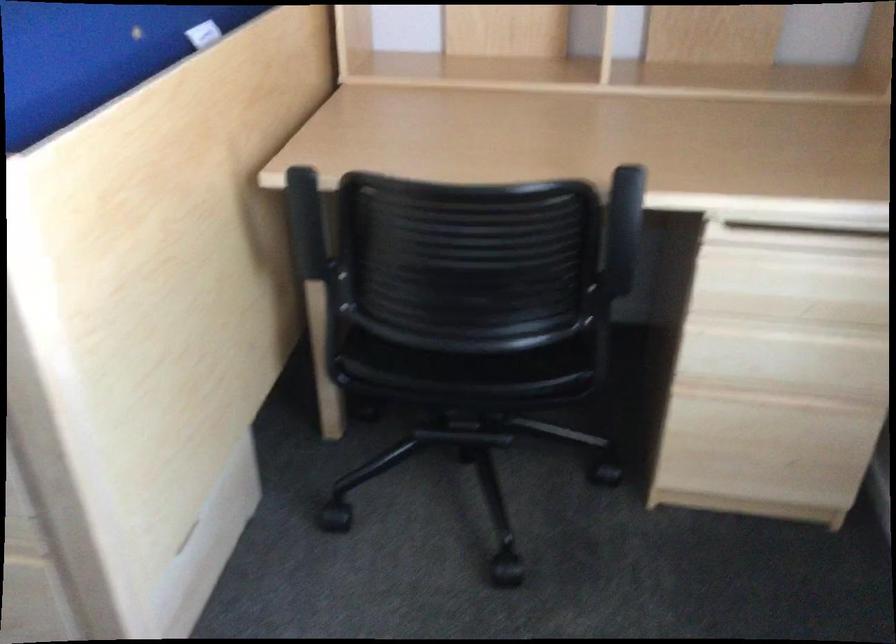
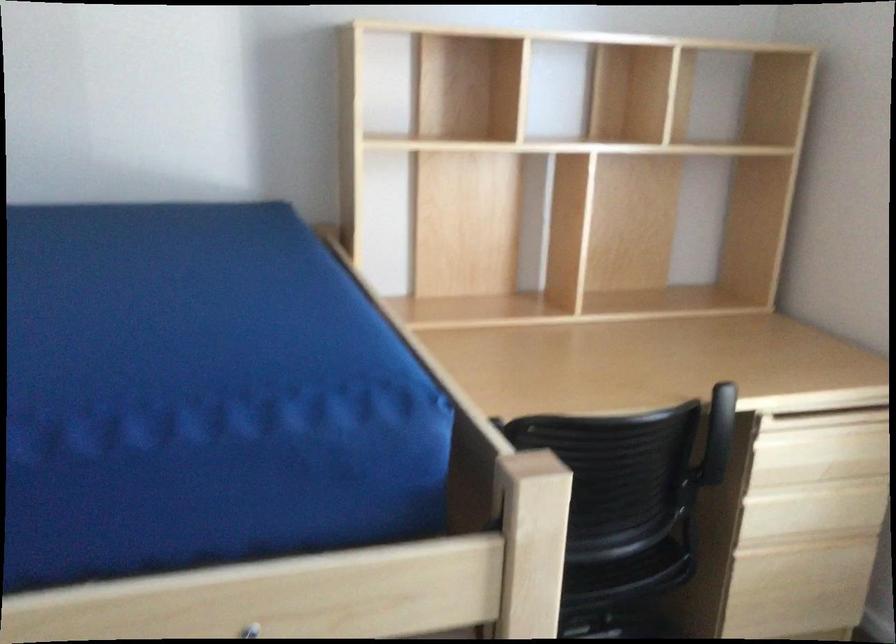
Question: The camera is either moving clockwise (left) or counter-clockwise (right) around the object. The first image is from the beginning of the video and the second image is from the end. Is the camera moving left or right when shooting the video?

Choices:
 (A) Left
 (B) Right

Answer: (A)